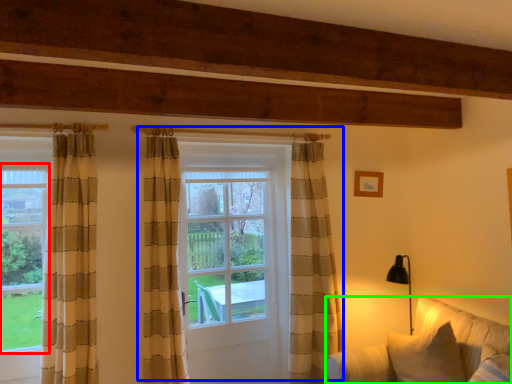
Question: Considering the real-world distances, which object is farthest from bay window (highlighted by a red box)? door (highlighted by a blue box) or studio couch (highlighted by a green box)?

Choices:
 (A) door
 (B) studio couch

Answer: (B)